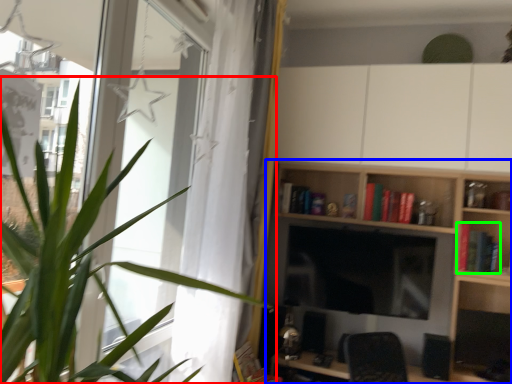
Question: Considering the real-world distances, which object is closest to houseplant (highlighted by a red box)? shelf (highlighted by a blue box) or book (highlighted by a green box).

Choices:
 (A) shelf
 (B) book

Answer: (A)